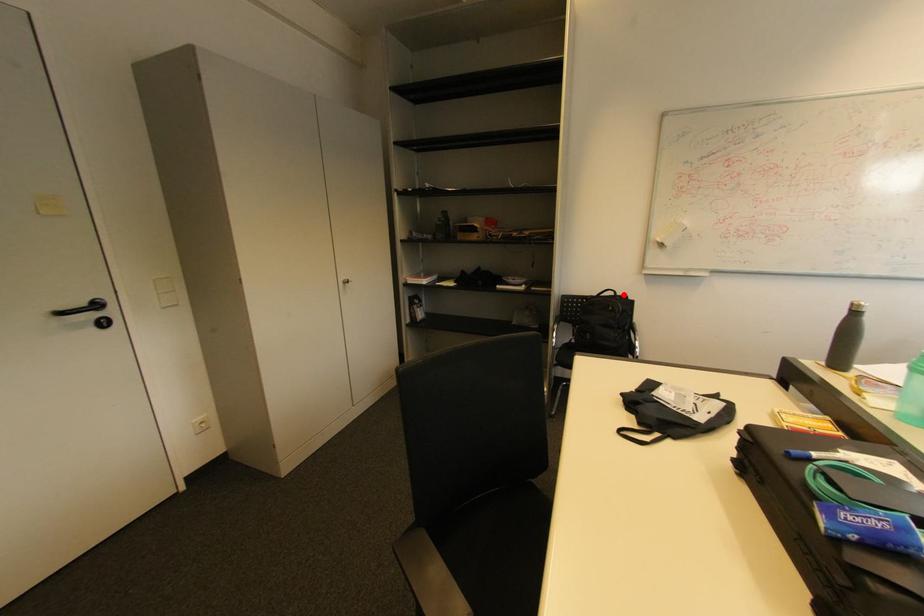
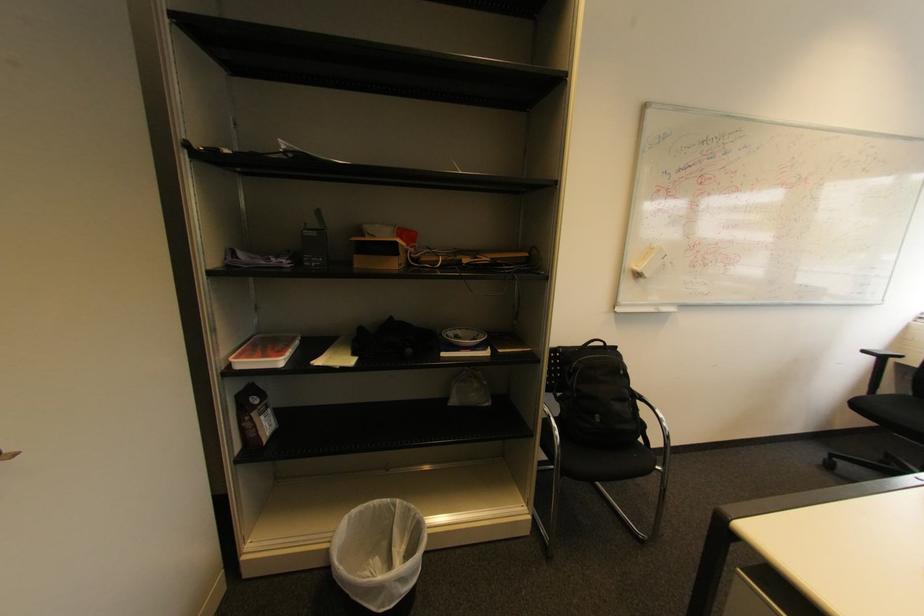
Find the pixel in the second image that matches the highlighted location in the first image.

(613, 345)